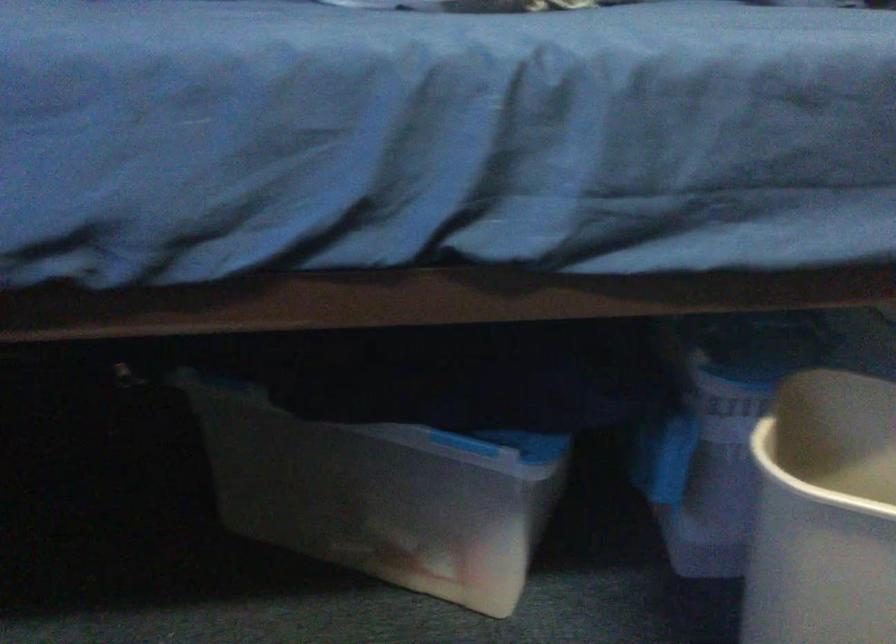
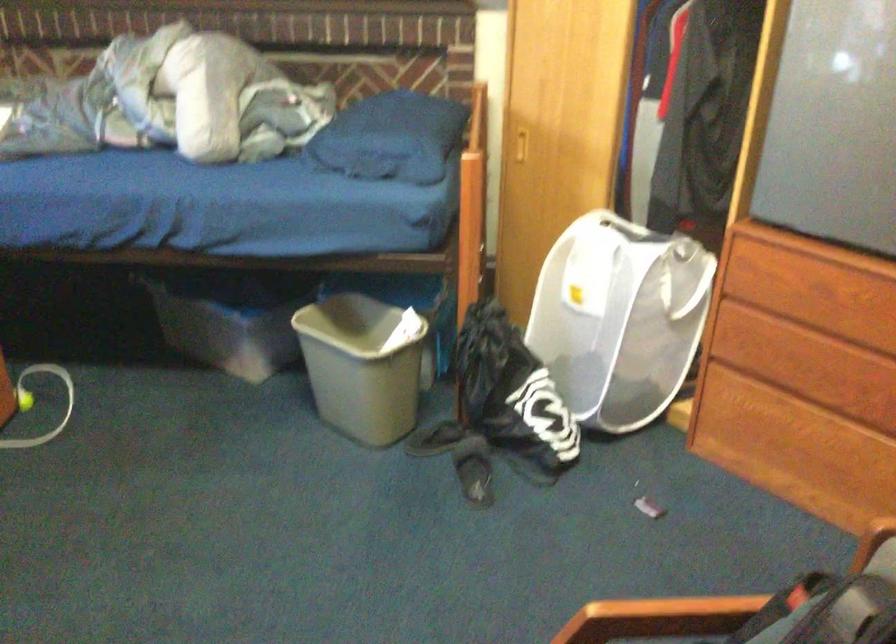
What movement of the cameraman would produce the second image?

The movement direction of the cameraman is right, backward.